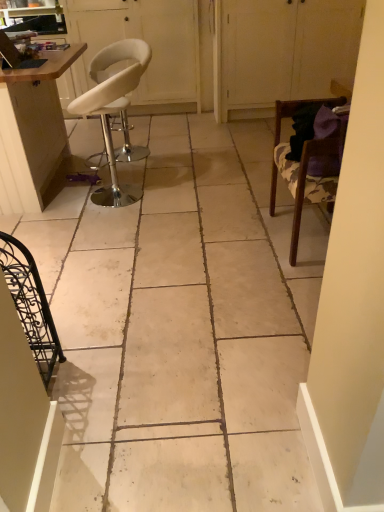
Question: Do you think white leather stool at left, the 2th chair from the right, is within black wrought iron chair at lower left, the third chair positioned from the back, or outside of it?

Choices:
 (A) outside
 (B) inside

Answer: (A)

Question: Is point (97, 90) closer or farther from the camera than point (31, 296)?

Choices:
 (A) closer
 (B) farther

Answer: (B)

Question: Which object is the closest to the white matte cabinet at upper right, arranged as the 1th screen door when viewed from the right?

Choices:
 (A) wooden chair at right, the first chair positioned from the right
 (B) white leather stool at upper left, the second screen door viewed from the right
 (C) wooden table at left
 (D) white leather stool at left, the 1th chair in the back-to-front sequence
 (E) black wrought iron chair at lower left, the third chair positioned from the back

Answer: (B)

Question: Which object is positioned closest to the white leather stool at upper left, the second screen door viewed from the right?

Choices:
 (A) white leather stool at left, which appears as the 2th chair when viewed from the left
 (B) wooden table at left
 (C) black wrought iron chair at lower left, the third chair positioned from the back
 (D) white matte cabinet at upper right, which is the 2th screen door in left-to-right order
 (E) wooden chair at right, placed as the second chair when sorted from back to front

Answer: (D)